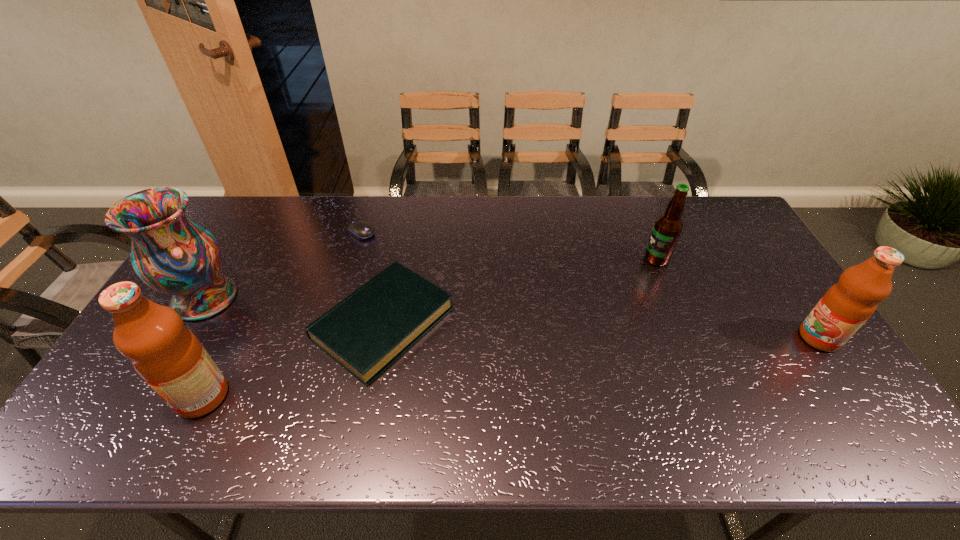
In order to click on free space at the right edge of the desktop in this screenshot , I will do `click(760, 335)`.

At what (x,y) coordinates should I click in order to perform the action: click on free space at the far left corner of the desktop. Please return your answer as a coordinate pair (x, y). Looking at the image, I should click on (228, 235).

What are the coordinates of `vacant space that is in between the right fruit juice and the book` in the screenshot? It's located at (601, 330).

Where is `free space between the farthest object and the nearer fruit juice`? free space between the farthest object and the nearer fruit juice is located at coordinates (282, 314).

At what (x,y) coordinates should I click in order to perform the action: click on vacant space that's between the beer bottle and the fifth tallest object. Please return your answer as a coordinate pair (x, y). The width and height of the screenshot is (960, 540). Looking at the image, I should click on (520, 291).

Find the location of a particular element. This screenshot has width=960, height=540. vacant space in between the nearer fruit juice and the shortest object is located at coordinates (282, 314).

Locate an element on the screen. free point between the taller fruit juice and the rightmost object is located at coordinates (511, 367).

Locate an element on the screen. vacant space that's between the farthest object and the fifth object from left to right is located at coordinates pos(509,246).

The height and width of the screenshot is (540, 960). Identify the location of unoccupied area between the nearer fruit juice and the fifth tallest object. (293, 360).

At what (x,y) coordinates should I click in order to perform the action: click on free spot between the taller fruit juice and the shortest object. Please return your answer as a coordinate pair (x, y). Looking at the image, I should click on (282, 314).